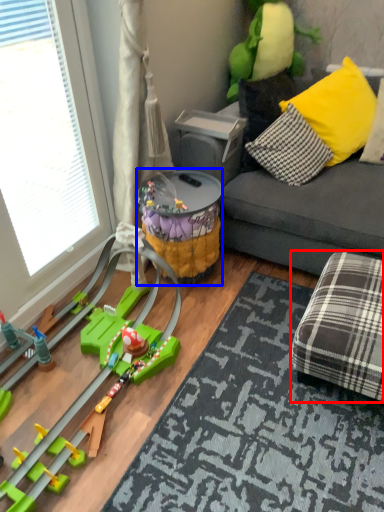
Question: Which of the following is the farthest to the observer, stool (highlighted by a red box) or toy (highlighted by a blue box)?

Choices:
 (A) stool
 (B) toy

Answer: (B)